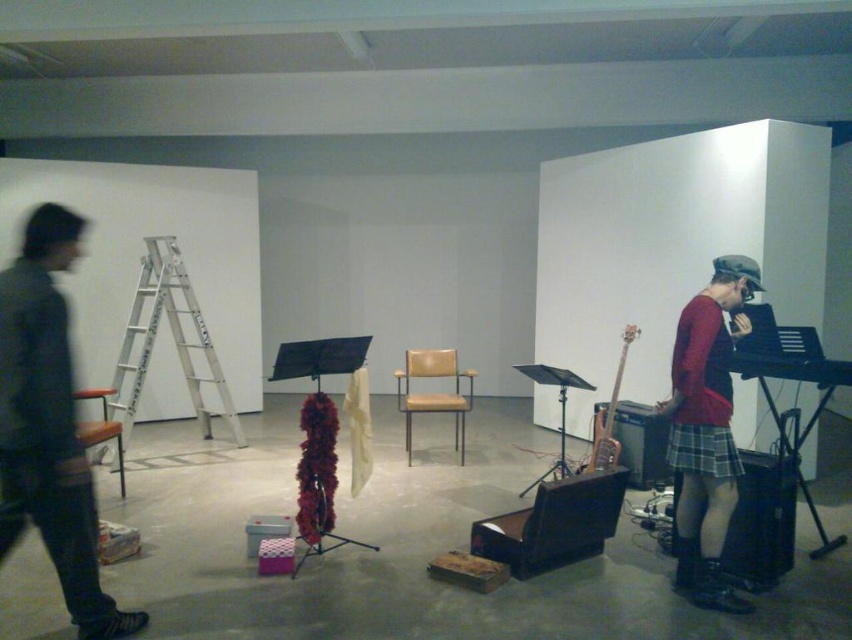
How far apart are tan leather chair at center and plaid fabric skirt at lower right?

tan leather chair at center and plaid fabric skirt at lower right are 2.31 meters apart from each other.

Looking at this image, between tan leather chair at center and plaid fabric skirt at lower right, which one has less height?

plaid fabric skirt at lower right is shorter.

Is point (415, 356) positioned in front of point (689, 474)?

No, it is not.

Locate an element on the screen. Image resolution: width=852 pixels, height=640 pixels. tan leather chair at center is located at coordinates (433, 392).

Is silver metallic ladder at left bigger than tan leather chair at center?

Correct, silver metallic ladder at left is larger in size than tan leather chair at center.

Does silver metallic ladder at left have a greater width compared to tan leather chair at center?

Yes, silver metallic ladder at left is wider than tan leather chair at center.

Locate an element on the screen. This screenshot has width=852, height=640. silver metallic ladder at left is located at coordinates (171, 339).

You are a GUI agent. You are given a task and a screenshot of the screen. Output one action in this format:
    pyautogui.click(x=<x>, y=<y>)
    Task: Click on the silver metallic ladder at left
    
    Given the screenshot: What is the action you would take?
    pyautogui.click(x=171, y=339)

From the picture: Is dark gray sweater at left bigger than tan leather chair at center?

Incorrect, dark gray sweater at left is not larger than tan leather chair at center.

From the picture: Is dark gray sweater at left positioned before tan leather chair at center?

Yes, it is.

Does point (4, 289) come behind point (417, 349)?

No, it is in front of (417, 349).

Locate an element on the screen. This screenshot has width=852, height=640. dark gray sweater at left is located at coordinates (49, 424).